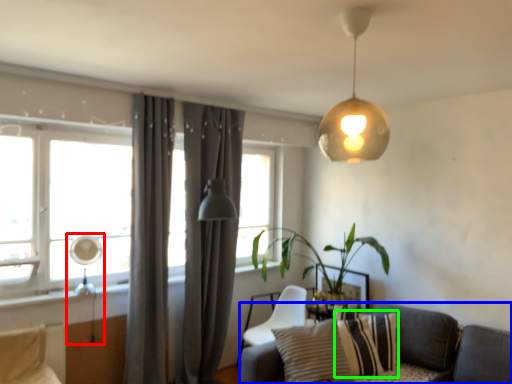
Question: Based on their relative distances, which object is nearer to table lamp (highlighted by a red box)? Choose from studio couch (highlighted by a blue box) and pillow (highlighted by a green box).

Choices:
 (A) studio couch
 (B) pillow

Answer: (B)